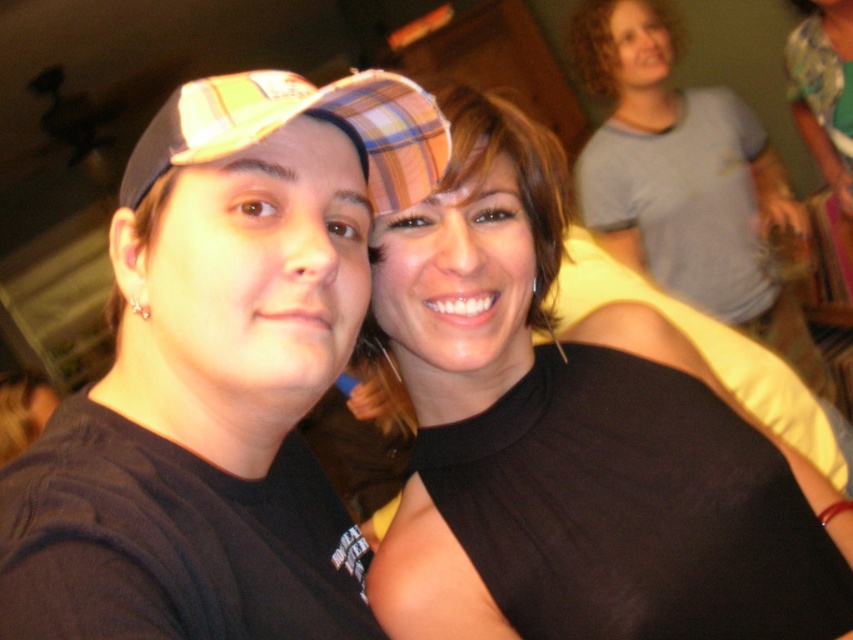
Question: Considering the real-world distances, which object is farthest from the black matte tank top at upper right?

Choices:
 (A) matte black cap at left
 (B) plaid fabric baseball cap at left

Answer: (B)

Question: Considering the real-world distances, which object is closest to the black matte tank top at upper right?

Choices:
 (A) plaid fabric baseball cap at left
 (B) matte black cap at left

Answer: (B)

Question: Can you confirm if matte black cap at left is positioned above plaid fabric baseball cap at left?

Choices:
 (A) yes
 (B) no

Answer: (B)

Question: Which point appears farthest from the camera in this image?

Choices:
 (A) (492, 196)
 (B) (415, 129)

Answer: (A)

Question: Does matte black cap at left appear over plaid fabric baseball cap at left?

Choices:
 (A) yes
 (B) no

Answer: (B)

Question: Can you confirm if matte black cap at left is thinner than black matte tank top at upper right?

Choices:
 (A) yes
 (B) no

Answer: (A)